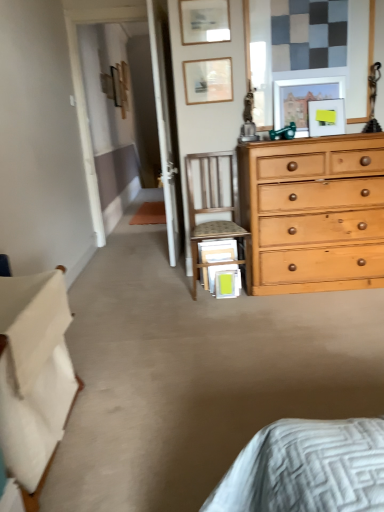
Measure the distance between point (199, 17) and camera.

Point (199, 17) is 2.75 meters from camera.

What do you see at coordinates (326, 117) in the screenshot? The width and height of the screenshot is (384, 512). I see `yellow matte picture frame at upper center, acting as the fourth picture frame starting from the back` at bounding box center [326, 117].

What do you see at coordinates (34, 376) in the screenshot? This screenshot has width=384, height=512. I see `white fabric bed at lower left` at bounding box center [34, 376].

You are a GUI agent. You are given a task and a screenshot of the screen. Output one action in this format:
    pyautogui.click(x=<x>, y=<y>)
    Task: Click on the matte wooden picture frame at upper center, the fifth picture frame positioned from the back
    
    Given the screenshot: What is the action you would take?
    pyautogui.click(x=204, y=21)

Based on the photo, would you consider wooden chair at center to be distant from wooden picture frame at upper center, the 2th picture frame in the back-to-front sequence?

No.

Looking at the image, does wooden chair at center seem bigger or smaller compared to wooden picture frame at upper center, which is the 3th picture frame from right to left?

In the image, wooden chair at center appears to be larger than wooden picture frame at upper center, which is the 3th picture frame from right to left.

How different are the orientations of wooden chair at center and wooden picture frame at upper center, which is the 3th picture frame from right to left, in degrees?

The angular difference between wooden chair at center and wooden picture frame at upper center, which is the 3th picture frame from right to left, is 0.746 degrees.

Considering the points (212, 199) and (230, 87), which point is in front, point (212, 199) or point (230, 87)?

The point (230, 87) is more forward.

Image resolution: width=384 pixels, height=512 pixels. Identify the location of picture frame that is the 4th one above the yellow matte picture frame at upper center, acting as the fourth picture frame starting from the back (from a real-world perspective). (204, 21).

Does matte wooden picture frame at upper center, positioned as the 2th picture frame in top-to-bottom order, appear on the right side of yellow matte picture frame at upper center, acting as the fourth picture frame starting from the back?

No.

Can you tell me how much matte wooden picture frame at upper center, the second picture frame in the left-to-right sequence, and yellow matte picture frame at upper center, acting as the fourth picture frame starting from the back, differ in facing direction?

The facing directions of matte wooden picture frame at upper center, the second picture frame in the left-to-right sequence, and yellow matte picture frame at upper center, acting as the fourth picture frame starting from the back, are 0.0053 degrees apart.

Does matte wooden picture frame at upper center, marked as the 4th picture frame in a bottom-to-top arrangement, have a lesser width compared to yellow matte picture frame at upper center, acting as the fourth picture frame starting from the back?

Yes, matte wooden picture frame at upper center, marked as the 4th picture frame in a bottom-to-top arrangement, is thinner than yellow matte picture frame at upper center, acting as the fourth picture frame starting from the back.

Would you consider yellow matte picture frame at upper center, placed as the second picture frame when sorted from front to back, to be distant from matte wooden picture frame at upper center, the fifth picture frame positioned from the back?

That's not correct — yellow matte picture frame at upper center, placed as the second picture frame when sorted from front to back, is a little close to matte wooden picture frame at upper center, the fifth picture frame positioned from the back.

Between yellow matte picture frame at upper center, acting as the fourth picture frame starting from the back, and matte wooden picture frame at upper center, which is the 4th picture frame in right-to-left order, which one has smaller width?

matte wooden picture frame at upper center, which is the 4th picture frame in right-to-left order, is thinner.

Consider the image. Which of these two, yellow matte picture frame at upper center, which is counted as the 5th picture frame, starting from the top, or matte wooden picture frame at upper center, which is the 4th picture frame in right-to-left order, is bigger?

yellow matte picture frame at upper center, which is counted as the 5th picture frame, starting from the top.

How far apart are yellow matte picture frame at upper center, the fifth picture frame from the left, and matte wooden picture frame at upper center, positioned as the 2th picture frame in top-to-bottom order?

yellow matte picture frame at upper center, the fifth picture frame from the left, is 33.67 inches away from matte wooden picture frame at upper center, positioned as the 2th picture frame in top-to-bottom order.

This screenshot has height=512, width=384. Find the location of `chair lying below the wooden picture frame at upper center, which is counted as the first picture frame, starting from the back (from the image's perspective)`. chair lying below the wooden picture frame at upper center, which is counted as the first picture frame, starting from the back (from the image's perspective) is located at coordinates (214, 208).

From a real-world perspective, which object rests below the other?

From a 3D spatial view, wooden chair at center is below.

Is wooden picture frame at upper center, the fifth picture frame in the bottom-to-top sequence, aimed at wooden chair at center?

No, wooden picture frame at upper center, the fifth picture frame in the bottom-to-top sequence, is not facing towards wooden chair at center.

Which of these two, wooden picture frame at upper center, the fifth picture frame in the bottom-to-top sequence, or wooden chair at center, stands taller?

wooden chair at center is taller.

Is matte wooden picture frame at upper right, acting as the fourth picture frame starting from the left, aimed at wooden picture frame at upper center, the 3th picture frame positioned from the bottom?

No.

Between matte wooden picture frame at upper right, acting as the fourth picture frame starting from the top, and wooden picture frame at upper center, the 3th picture frame positioned from the bottom, which one has larger size?

matte wooden picture frame at upper right, acting as the fourth picture frame starting from the top, is bigger.

From a real-world perspective, is matte wooden picture frame at upper right, marked as the third picture frame in a front-to-back arrangement, positioned above or below wooden picture frame at upper center, the 3th picture frame positioned from the bottom?

→ In terms of real-world spatial position, matte wooden picture frame at upper right, marked as the third picture frame in a front-to-back arrangement, is below wooden picture frame at upper center, the 3th picture frame positioned from the bottom.

From the image's perspective, which is above, wooden picture frame at upper center, the 4th picture frame in the front-to-back sequence, or yellow matte picture frame at upper center, placed as the second picture frame when sorted from front to back?

wooden picture frame at upper center, the 4th picture frame in the front-to-back sequence, from the image's perspective.

Looking at this image, can you tell me how much wooden picture frame at upper center, which is the 3th picture frame from right to left, and yellow matte picture frame at upper center, the fifth picture frame from the left, differ in facing direction?

0.0067 degrees.

Considering the relative sizes of wooden picture frame at upper center, which is the 3th picture frame from right to left, and yellow matte picture frame at upper center, arranged as the 1th picture frame when ordered from the bottom, in the image provided, is wooden picture frame at upper center, which is the 3th picture frame from right to left, taller than yellow matte picture frame at upper center, arranged as the 1th picture frame when ordered from the bottom,?

Yes.

From a real-world perspective, which picture frame is the 2nd one underneath the wooden picture frame at upper center, the 4th picture frame in the front-to-back sequence? Please provide its 2D coordinates.

[(326, 117)]

Is wooden picture frame at upper center, which is the 3th picture frame from right to left, to the left of white fabric bed at lower left from the viewer's perspective?

In fact, wooden picture frame at upper center, which is the 3th picture frame from right to left, is to the right of white fabric bed at lower left.

Is there a large distance between wooden picture frame at upper center, the 2th picture frame in the back-to-front sequence, and white fabric bed at lower left?

That's right, there is a large distance between wooden picture frame at upper center, the 2th picture frame in the back-to-front sequence, and white fabric bed at lower left.

Would you say wooden picture frame at upper center, which is the 3th picture frame from right to left, is outside white fabric bed at lower left?

Yes.

From the picture: Can you confirm if wooden picture frame at upper center, the 2th picture frame in the back-to-front sequence, is wider than white fabric bed at lower left?

Incorrect, the width of wooden picture frame at upper center, the 2th picture frame in the back-to-front sequence, does not surpass that of white fabric bed at lower left.

Locate an element on the screen. Image resolution: width=384 pixels, height=512 pixels. chair in front of the wooden picture frame at upper center, the 4th picture frame in the front-to-back sequence is located at coordinates (214, 208).

Find the location of a particular element. picture frame that is the 1st one when counting backward from the matte wooden picture frame at upper center, the second picture frame in the left-to-right sequence is located at coordinates (326, 117).

From the picture: Estimate the real-world distances between objects in this image. Which object is closer to white fabric bed at lower left, wooden picture frame at upper center, which is the 3th picture frame from right to left, or wooden picture frame at upper center, arranged as the fifth picture frame when viewed from the right?

Based on the image, wooden picture frame at upper center, which is the 3th picture frame from right to left, appears to be nearer to white fabric bed at lower left.

From the image, which object appears to be nearer to matte wooden picture frame at upper center, which is the 4th picture frame in right-to-left order, wooden chair at center or wooden picture frame at upper center, the fifth picture frame in the bottom-to-top sequence?

wooden chair at center.

Based on the photo, based on their spatial positions, is wooden picture frame at upper center, which is counted as the first picture frame, starting from the back, or yellow matte picture frame at upper center, placed as the second picture frame when sorted from front to back, closer to white fabric bed at lower left?

Based on the image, yellow matte picture frame at upper center, placed as the second picture frame when sorted from front to back, appears to be nearer to white fabric bed at lower left.

Looking at the image, which one is located closer to yellow matte picture frame at upper center, acting as the fourth picture frame starting from the back, white fabric bed at lower left or wooden chair at center?

The object closer to yellow matte picture frame at upper center, acting as the fourth picture frame starting from the back, is wooden chair at center.

Based on their spatial positions, is matte wooden picture frame at upper center, which is the 4th picture frame in right-to-left order, or yellow matte picture frame at upper center, positioned as the 1th picture frame in right-to-left order, closer to wooden picture frame at upper center, marked as the fifth picture frame in a front-to-back arrangement?

matte wooden picture frame at upper center, which is the 4th picture frame in right-to-left order, is closer to wooden picture frame at upper center, marked as the fifth picture frame in a front-to-back arrangement.

Based on their spatial positions, is yellow matte picture frame at upper center, the fifth picture frame from the left, or matte wooden picture frame at upper center, which is the 4th picture frame in right-to-left order, closer to white fabric bed at lower left?

Among the two, matte wooden picture frame at upper center, which is the 4th picture frame in right-to-left order, is located nearer to white fabric bed at lower left.

Considering their positions, is wooden picture frame at upper center, marked as the fifth picture frame in a front-to-back arrangement, positioned closer to wooden picture frame at upper center, which is the 3th picture frame from left to right, than wooden chair at center?

wooden chair at center lies closer to wooden picture frame at upper center, which is the 3th picture frame from left to right, than the other object.

Which object lies further to the anchor point matte wooden picture frame at upper right, acting as the fourth picture frame starting from the top, wooden chair at center or wooden picture frame at upper center, the 3th picture frame positioned from the bottom?

wooden chair at center.

Locate an element on the screen. The height and width of the screenshot is (512, 384). picture frame between matte wooden picture frame at upper right, marked as the third picture frame in a front-to-back arrangement, and wooden picture frame at upper center, the fifth picture frame in the bottom-to-top sequence, from front to back is located at coordinates (208, 80).

At what (x,y) coordinates should I click in order to perform the action: click on picture frame between matte wooden picture frame at upper right, marked as the second picture frame in a bottom-to-top arrangement, and wooden chair at center from top to bottom. Please return your answer as a coordinate pair (x, y). The height and width of the screenshot is (512, 384). Looking at the image, I should click on tap(326, 117).

Locate an element on the screen. This screenshot has width=384, height=512. chair positioned between white fabric bed at lower left and matte wooden picture frame at upper right, marked as the second picture frame in a bottom-to-top arrangement, from near to far is located at coordinates (214, 208).

Where is `picture frame between wooden picture frame at upper center, the 4th picture frame in the front-to-back sequence, and yellow matte picture frame at upper center, the fifth picture frame from the left, from left to right`? The width and height of the screenshot is (384, 512). picture frame between wooden picture frame at upper center, the 4th picture frame in the front-to-back sequence, and yellow matte picture frame at upper center, the fifth picture frame from the left, from left to right is located at coordinates (303, 98).